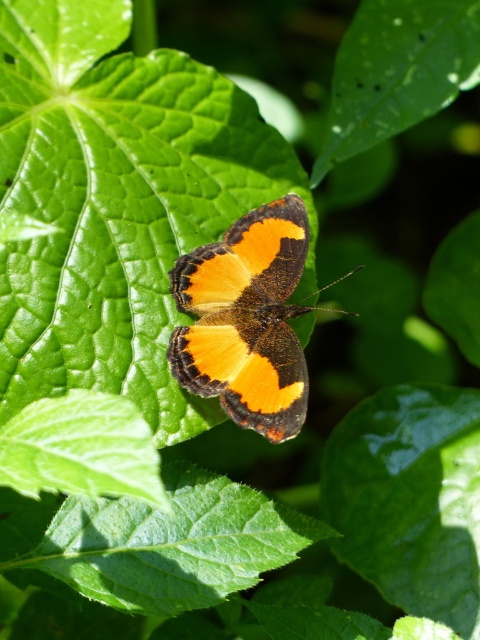
Question: Is orange matte butterfly at center positioned before glossy green leaf at upper center?

Choices:
 (A) yes
 (B) no

Answer: (A)

Question: Which of the following is the farthest from the observer?

Choices:
 (A) glossy green leaf at upper center
 (B) orange matte butterfly at center

Answer: (A)

Question: Observing the image, what is the correct spatial positioning of green smooth leaf at center in reference to glossy green leaf at upper center?

Choices:
 (A) right
 (B) left

Answer: (B)

Question: Which object is the closest to the orange matte butterfly at center?

Choices:
 (A) green smooth leaf at center
 (B) glossy green leaf at upper center

Answer: (A)

Question: Does green smooth leaf at center appear over glossy green leaf at upper center?

Choices:
 (A) yes
 (B) no

Answer: (B)

Question: Which of these objects is positioned closest to the orange matte butterfly at center?

Choices:
 (A) green smooth leaf at center
 (B) glossy green leaf at upper center

Answer: (A)